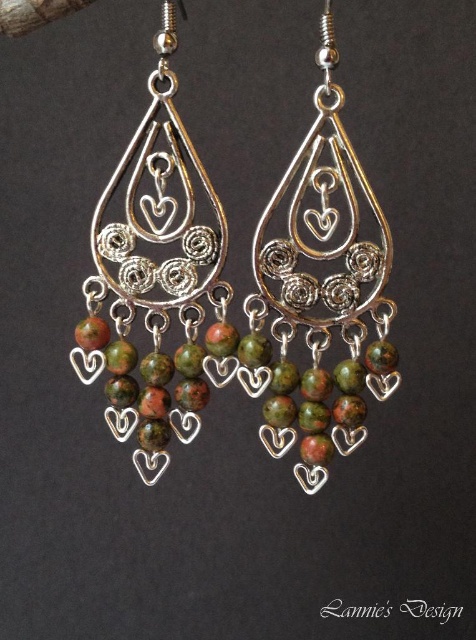
Question: Is green marbled beads at center bigger than green marble earrings at center?

Choices:
 (A) no
 (B) yes

Answer: (A)

Question: Is green marbled beads at center wider than green marble earrings at center?

Choices:
 (A) no
 (B) yes

Answer: (A)

Question: Is green marbled beads at center behind green marble earrings at center?

Choices:
 (A) no
 (B) yes

Answer: (A)

Question: Which point is closer to the camera?

Choices:
 (A) (184, 365)
 (B) (298, 269)

Answer: (A)

Question: Which point is farther to the camera?

Choices:
 (A) green marble earrings at center
 (B) green marbled beads at center

Answer: (A)